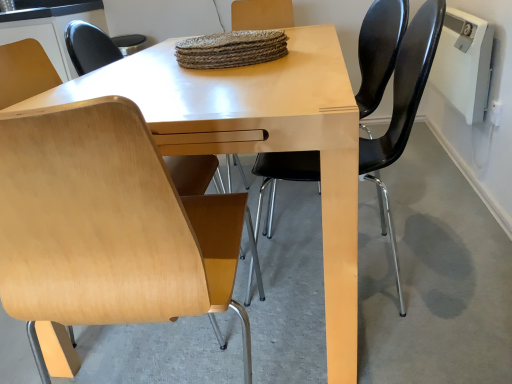
Question: Which is correct: black leather chair at right, which appears as the first chair when viewed from the right, is inside beech wood chair at lower left, or outside of it?

Choices:
 (A) outside
 (B) inside

Answer: (A)

Question: In the image, is black leather chair at right, positioned as the second chair in left-to-right order, positioned in front of or behind beech wood chair at lower left?

Choices:
 (A) behind
 (B) front

Answer: (B)

Question: Which of these objects is positioned farthest from the black leather chair at right, positioned as the second chair in left-to-right order?

Choices:
 (A) beech wood chair at left, placed as the first chair when sorted from left to right
 (B) beech wood chair at lower left

Answer: (A)

Question: Which is farther from the beech wood chair at left, which is counted as the 2th chair, starting from the right?

Choices:
 (A) beech wood chair at lower left
 (B) black leather chair at right, positioned as the second chair in left-to-right order

Answer: (A)